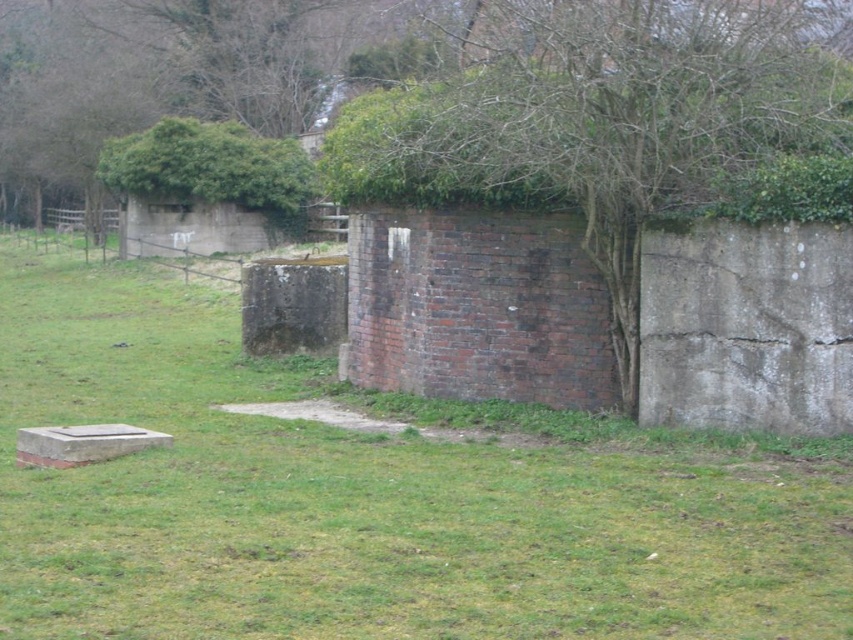
Question: Does green grassy at lower left come in front of green leafy tree at upper right?

Choices:
 (A) yes
 (B) no

Answer: (A)

Question: Which point appears closest to the camera in this image?

Choices:
 (A) (190, 136)
 (B) (730, 45)

Answer: (B)

Question: Is the position of green grassy at lower left less distant than that of green leafy tree at upper right?

Choices:
 (A) no
 (B) yes

Answer: (B)

Question: Which of the following is the farthest from the observer?

Choices:
 (A) (223, 132)
 (B) (51, 410)

Answer: (A)

Question: Can you confirm if green grassy at lower left is wider than green leafy hedge at upper left?

Choices:
 (A) no
 (B) yes

Answer: (B)

Question: Which point appears farthest from the camera in this image?

Choices:
 (A) (128, 134)
 (B) (618, 76)

Answer: (A)